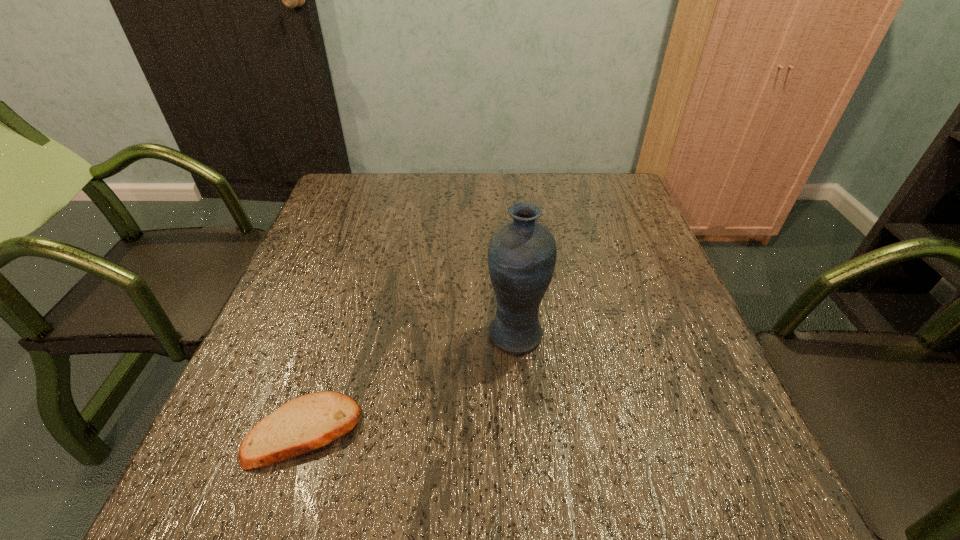
Locate an element on the screen. the taller object is located at coordinates (522, 253).

The width and height of the screenshot is (960, 540). I want to click on vase, so click(x=522, y=253).

Identify the location of the shorter object. The width and height of the screenshot is (960, 540). (306, 423).

This screenshot has height=540, width=960. In order to click on the nearer object in this screenshot , I will do `click(306, 423)`.

I want to click on free space located 0.170m on the front of the right object, so click(x=524, y=438).

I want to click on vacant space located 0.230m on the right of the pita bread, so click(493, 430).

Where is `object at the near edge`? object at the near edge is located at coordinates (306, 423).

Find the location of a particular element. object located in the left edge section of the desktop is located at coordinates point(306,423).

Locate an element on the screen. This screenshot has height=540, width=960. object situated at the near left corner is located at coordinates (306, 423).

At what (x,y) coordinates should I click in order to perform the action: click on vacant space at the far edge of the desktop. Please return your answer as a coordinate pair (x, y). Image resolution: width=960 pixels, height=540 pixels. Looking at the image, I should click on (451, 203).